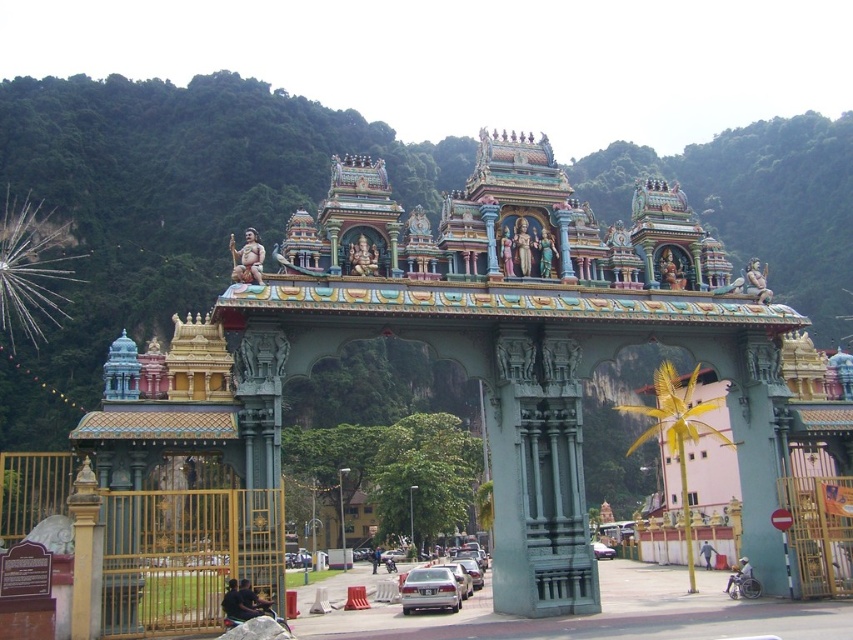
Between polished bronze statue at center and dark blue shirt at center, which one appears on the left side from the viewer's perspective?

Positioned to the left is dark blue shirt at center.

Who is lower down, polished bronze statue at center or dark blue shirt at center?

Positioned lower is dark blue shirt at center.

Is point (540, 252) closer to viewer compared to point (379, 552)?

Yes, it is in front of point (379, 552).

Locate an element on the screen. polished bronze statue at center is located at coordinates (546, 253).

Between dark skin human at center and dark blue shirt at center, which one has less height?

dark skin human at center is shorter.

Does dark skin human at center appear under dark blue shirt at center?

Incorrect, dark skin human at center is not positioned below dark blue shirt at center.

Is point (271, 602) positioned behind point (374, 570)?

That is False.

Locate an element on the screen. dark skin human at center is located at coordinates (252, 600).

Who is taller, smooth golden statue at center or polished bronze statue at center?

smooth golden statue at center

Is point (257, 272) behind point (555, 275)?

No.

Measure the distance between smooth golden statue at center and camera.

smooth golden statue at center is 54.86 meters away from camera.

Image resolution: width=853 pixels, height=640 pixels. I want to click on smooth golden statue at center, so click(x=247, y=259).